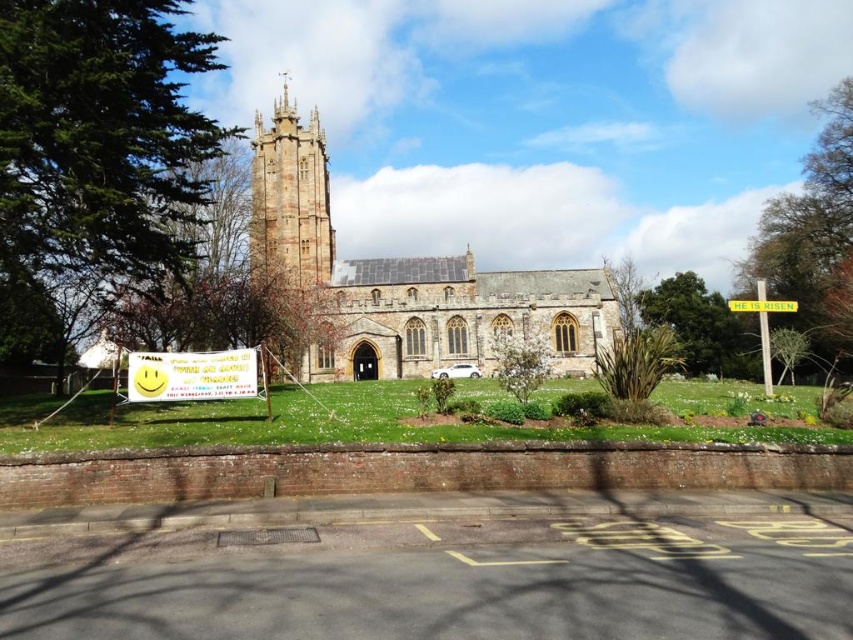
Does yellow paper sign at center appear under yellow plastic sign at center?

Indeed, yellow paper sign at center is positioned under yellow plastic sign at center.

The width and height of the screenshot is (853, 640). What do you see at coordinates (190, 376) in the screenshot? I see `yellow paper sign at center` at bounding box center [190, 376].

Which is in front, point (201, 396) or point (770, 305)?

Point (201, 396)

Identify the location of yellow paper sign at center. (190, 376).

Is yellow paper sign at center further to the viewer compared to yellow plastic sign at right?

No, it is in front of yellow plastic sign at right.

Between yellow paper sign at center and yellow plastic sign at right, which one appears on the right side from the viewer's perspective?

Positioned to the right is yellow plastic sign at right.

Is point (209, 365) positioned after point (764, 348)?

No, it is not.

You are a GUI agent. You are given a task and a screenshot of the screen. Output one action in this format:
    pyautogui.click(x=<x>, y=<y>)
    Task: Click on the yellow paper sign at center
    
    Given the screenshot: What is the action you would take?
    pyautogui.click(x=190, y=376)

Consider the image. Who is more forward, (285, 214) or (769, 381)?

Point (769, 381) is in front.

Can you confirm if stone gothic tower at center is thinner than yellow plastic sign at right?

In fact, stone gothic tower at center might be wider than yellow plastic sign at right.

I want to click on stone gothic tower at center, so click(x=291, y=205).